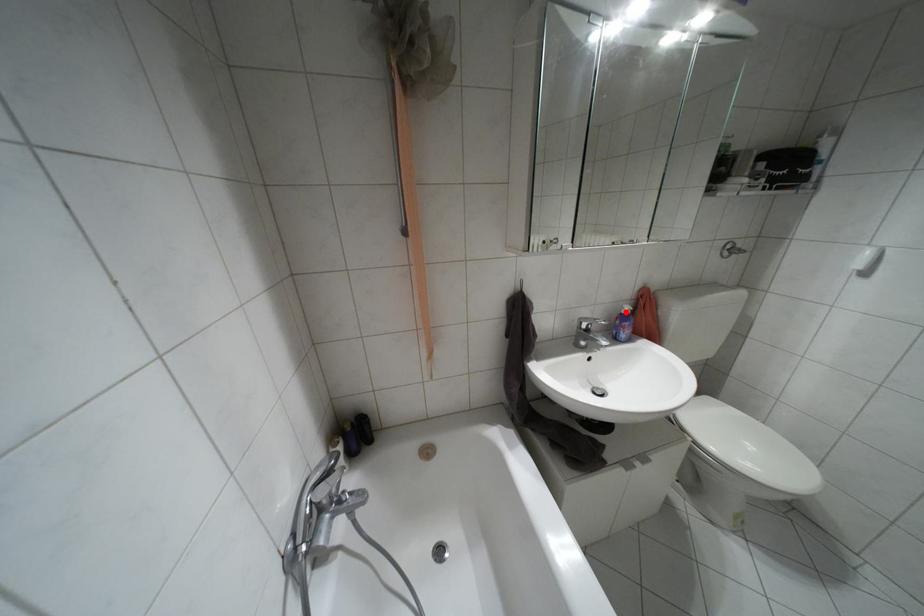
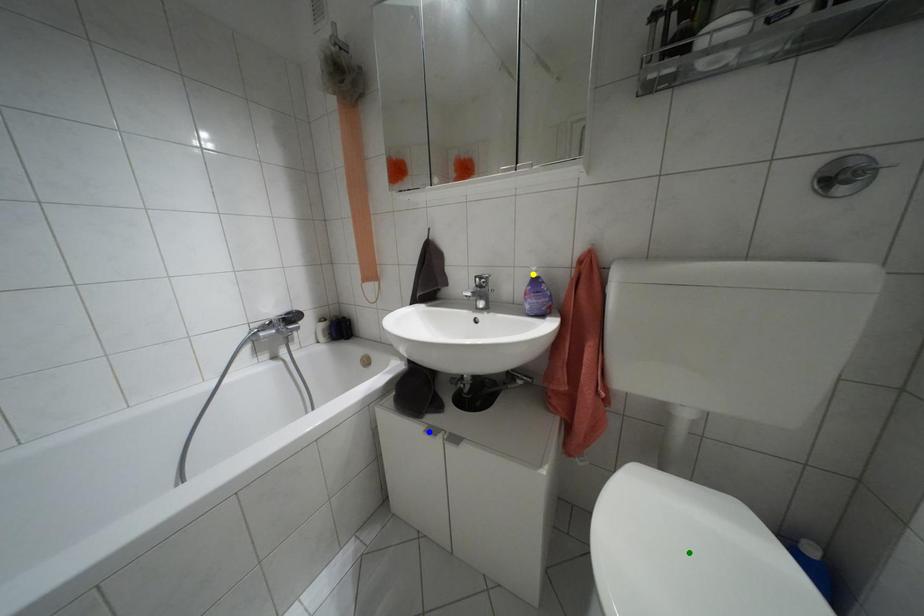
Question: I am providing you with two images of the same scene from different viewpoints. A red point is marked on the first image. You are given multiple points on the second image. Can you choose the point in image 2 that corresponds to the point in image 1?

Choices:
 (A) yellow point
 (B) green point
 (C) blue point

Answer: (A)